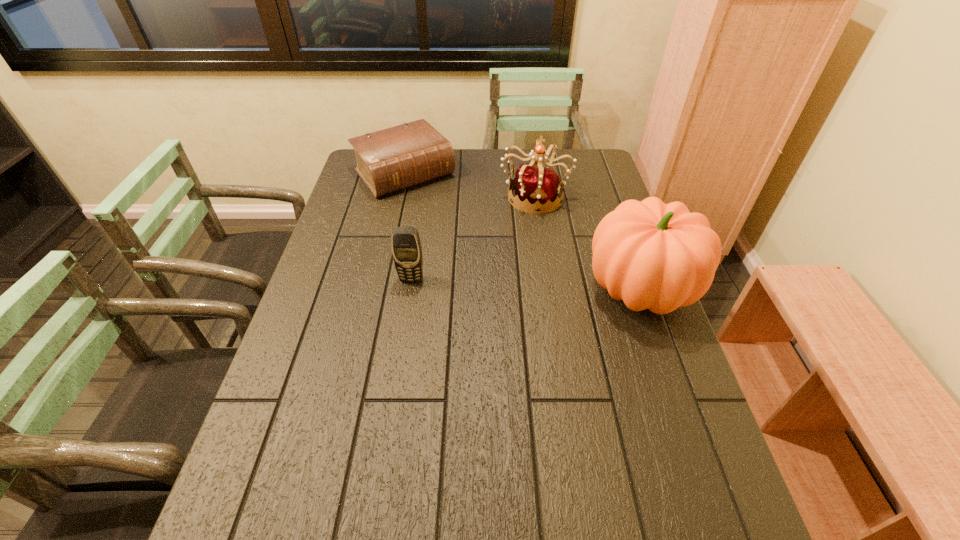
Find the location of `vacant region located 0.120m on the spine side of the shortest object`. vacant region located 0.120m on the spine side of the shortest object is located at coordinates (443, 216).

Where is `free region located 0.220m on the spine side of the shortest object`? This screenshot has height=540, width=960. free region located 0.220m on the spine side of the shortest object is located at coordinates (458, 233).

Where is `tiara that is at the far edge`? tiara that is at the far edge is located at coordinates (533, 184).

Identify the location of Bible present at the far edge. (393, 159).

Locate an element on the screen. This screenshot has height=540, width=960. object present at the left edge is located at coordinates (393, 159).

Find the location of a particular element. The width and height of the screenshot is (960, 540). pumpkin at the right edge is located at coordinates (652, 255).

At what (x,y) coordinates should I click in order to perform the action: click on tiara located at the right edge. Please return your answer as a coordinate pair (x, y). This screenshot has height=540, width=960. Looking at the image, I should click on pyautogui.click(x=533, y=184).

Find the location of a particular element. object positioned at the far left corner is located at coordinates (393, 159).

This screenshot has height=540, width=960. In order to click on object that is positioned at the far right corner in this screenshot , I will do `click(533, 184)`.

At what (x,y) coordinates should I click in order to perform the action: click on vacant space at the far edge of the desktop. Please return your answer as a coordinate pair (x, y). Looking at the image, I should click on (505, 160).